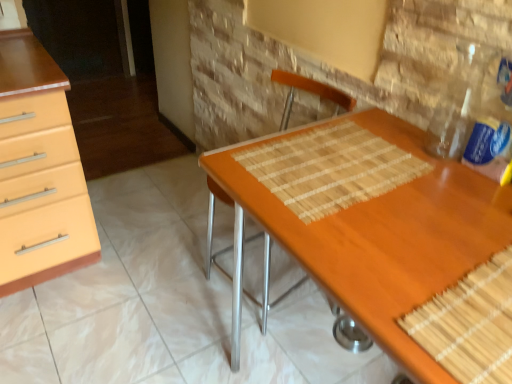
Find the location of a particular element. wooden desk at center is located at coordinates (379, 237).

Where is `orange woven fabric chair at center`? Image resolution: width=512 pixels, height=384 pixels. orange woven fabric chair at center is located at coordinates [x=222, y=269].

Are orange woven fabric chair at center and clear plastic bottle at upper right far apart?

No, orange woven fabric chair at center is not far from clear plastic bottle at upper right.

At what (x,y) coordinates should I click in order to perform the action: click on armchair that appears on the left of clear plastic bottle at upper right. Please return your answer as a coordinate pair (x, y). Image resolution: width=512 pixels, height=384 pixels. Looking at the image, I should click on (222, 269).

Measure the distance between orange woven fabric chair at center and clear plastic bottle at upper right.

orange woven fabric chair at center is 36.70 inches away from clear plastic bottle at upper right.

Is wooden desk at center located outside bamboo placemat at center?

Yes.

You are a GUI agent. You are given a task and a screenshot of the screen. Output one action in this format:
    pyautogui.click(x=<x>, y=<y>)
    Task: Click on the desk that appears in front of the bamboo placemat at center
    The height and width of the screenshot is (384, 512).
    Given the screenshot: What is the action you would take?
    pyautogui.click(x=379, y=237)

From the image's perspective, between wooden desk at center and bamboo placemat at center, which one is located above?

From the image's view, bamboo placemat at center is above.

This screenshot has height=384, width=512. Find the location of `armchair lying below the clear plastic bottle at upper right (from the image's perspective)`. armchair lying below the clear plastic bottle at upper right (from the image's perspective) is located at coordinates (222, 269).

Is clear plastic bottle at upper right next to orange woven fabric chair at center and touching it?

No, clear plastic bottle at upper right is not with orange woven fabric chair at center.

From the image's perspective, would you say clear plastic bottle at upper right is shown under orange woven fabric chair at center?

No.

Is orange woven fabric chair at center at the back of bamboo placemat at center?

That's right, bamboo placemat at center is facing away from orange woven fabric chair at center.

Considering the points (393, 146) and (348, 337), which point is behind, point (393, 146) or point (348, 337)?

The point (348, 337) is farther from the camera.

Is bamboo placemat at center bigger or smaller than orange woven fabric chair at center?

bamboo placemat at center is smaller than orange woven fabric chair at center.

This screenshot has width=512, height=384. In order to click on armchair on the left of bamboo placemat at center in this screenshot , I will do [222, 269].

Is wooden desk at center not within clear plastic bottle at upper right?

Yes.

Where is `bottle behind the wooden desk at center`? The width and height of the screenshot is (512, 384). bottle behind the wooden desk at center is located at coordinates (459, 102).

From the image's perspective, relative to clear plastic bottle at upper right, is wooden desk at center above or below?

From the image's perspective, wooden desk at center appears below clear plastic bottle at upper right.

Does wooden desk at center have a larger size compared to clear plastic bottle at upper right?

Yes, wooden desk at center is bigger than clear plastic bottle at upper right.

Is clear plastic bottle at upper right with wooden desk at center?

No, clear plastic bottle at upper right is not touching wooden desk at center.

Is clear plastic bottle at upper right in front of or behind wooden desk at center in the image?

Visually, clear plastic bottle at upper right is located behind wooden desk at center.

Is clear plastic bottle at upper right positioned with its back to wooden desk at center?

No, wooden desk at center is not at the back of clear plastic bottle at upper right.

Identify the location of desk below the clear plastic bottle at upper right (from the image's perspective). The height and width of the screenshot is (384, 512). click(379, 237).

Is clear plastic bottle at upper right situated inside bamboo placemat at center or outside?

clear plastic bottle at upper right is located beyond the bounds of bamboo placemat at center.

Considering the positions of point (471, 115) and point (344, 183), is point (471, 115) closer or farther from the camera than point (344, 183)?

Point (471, 115).

Is clear plastic bottle at upper right closer to camera compared to bamboo placemat at center?

Yes, clear plastic bottle at upper right is in front of bamboo placemat at center.

From a real-world perspective, is clear plastic bottle at upper right positioned above or below bamboo placemat at center?

Clearly, from a real-world perspective, clear plastic bottle at upper right is above bamboo placemat at center.

Where is `bottle above the orange woven fabric chair at center (from the image's perspective)`? This screenshot has height=384, width=512. bottle above the orange woven fabric chair at center (from the image's perspective) is located at coordinates (459, 102).

Locate an element on the screen. Image resolution: width=512 pixels, height=384 pixels. desk below the bamboo placemat at center (from the image's perspective) is located at coordinates (379, 237).

Which object lies nearer to the anchor point clear plastic bottle at upper right, orange woven fabric chair at center or bamboo placemat at center?

bamboo placemat at center is closer to clear plastic bottle at upper right.

Estimate the real-world distances between objects in this image. Which object is closer to wooden desk at center, clear plastic bottle at upper right or orange woven fabric chair at center?

clear plastic bottle at upper right is positioned closer to the anchor wooden desk at center.

From the picture: When comparing their distances from clear plastic bottle at upper right, does wooden desk at center or orange woven fabric chair at center seem closer?

Among the two, wooden desk at center is located nearer to clear plastic bottle at upper right.

Estimate the real-world distances between objects in this image. Which object is closer to wooden desk at center, bamboo placemat at center or clear plastic bottle at upper right?

bamboo placemat at center.

Considering their positions, is wooden desk at center positioned further to bamboo placemat at center than orange woven fabric chair at center?

orange woven fabric chair at center.

Looking at the image, which one is located closer to clear plastic bottle at upper right, orange woven fabric chair at center or wooden desk at center?

Among the two, wooden desk at center is located nearer to clear plastic bottle at upper right.

When comparing their distances from wooden desk at center, does orange woven fabric chair at center or bamboo placemat at center seem closer?

bamboo placemat at center.

When comparing their distances from bamboo placemat at center, does clear plastic bottle at upper right or orange woven fabric chair at center seem further?

Based on the image, orange woven fabric chair at center appears to be further to bamboo placemat at center.

Identify the location of place mat between wooden desk at center and orange woven fabric chair at center from front to back. Image resolution: width=512 pixels, height=384 pixels. (330, 168).

This screenshot has height=384, width=512. What are the coordinates of `desk between orange woven fabric chair at center and clear plastic bottle at upper right` in the screenshot? It's located at (379, 237).

At what (x,y) coordinates should I click in order to perform the action: click on place mat situated between orange woven fabric chair at center and clear plastic bottle at upper right from left to right. Please return your answer as a coordinate pair (x, y). This screenshot has width=512, height=384. Looking at the image, I should click on (330, 168).

At what (x,y) coordinates should I click in order to perform the action: click on place mat between clear plastic bottle at upper right and wooden desk at center vertically. Please return your answer as a coordinate pair (x, y). This screenshot has height=384, width=512. Looking at the image, I should click on (330, 168).